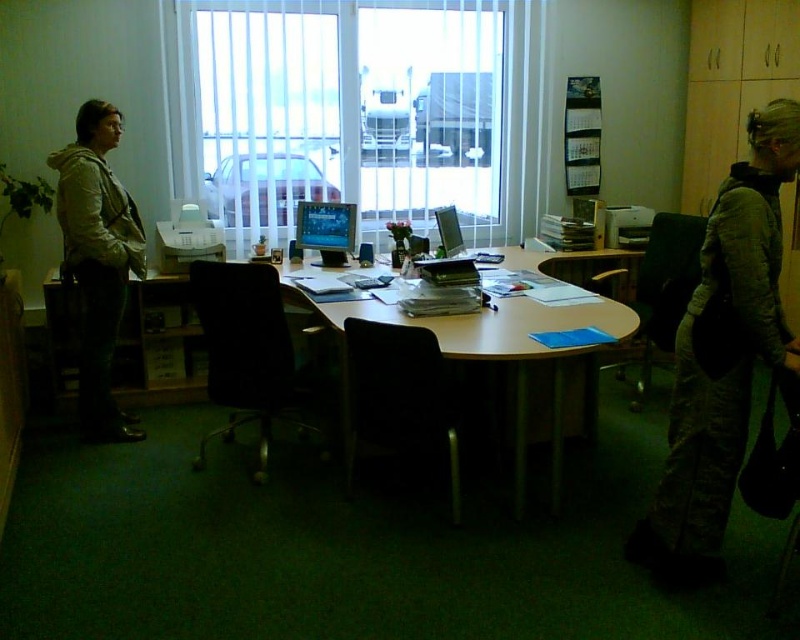
You are an office worker who needs to move the black fabric swivel chair at center to the other side of the room. Considering the white vertical blinds at center, will the chair fit through the space between the blinds and the wall?

The white vertical blinds at center are wider than the black fabric swivel chair at center, so the chair can fit through the space between the blinds and the wall.

You are organizing a meeting in this office and need to determine seating arrangements. The wooden table at center is where the meeting will take place. If you want to place an additional chair next to the existing black leather swivel chair at center, will there be enough space considering the table size?

The wooden table at center has a larger size compared to the black leather swivel chair at center, so there should be enough space to add another chair next to the existing black leather swivel chair at center.